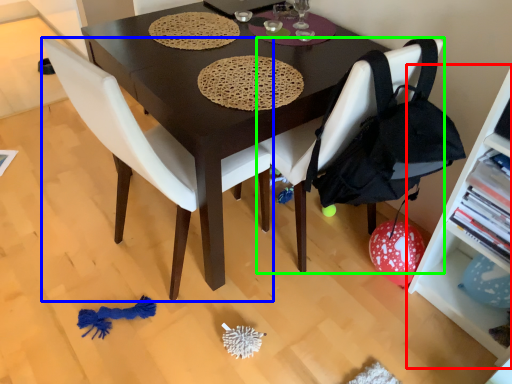
Question: Estimate the real-world distances between objects in this image. Which object is farther from shelf (highlighted by a red box), chair (highlighted by a blue box) or chair (highlighted by a green box)?

Choices:
 (A) chair
 (B) chair

Answer: (A)